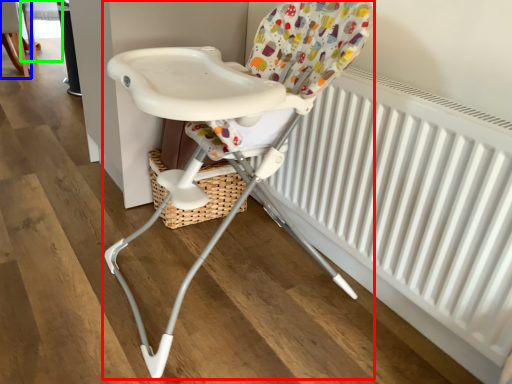
Question: Which is farther away from chair (highlighted by a red box)? chair (highlighted by a blue box) or chair (highlighted by a green box)?

Choices:
 (A) chair
 (B) chair

Answer: (B)